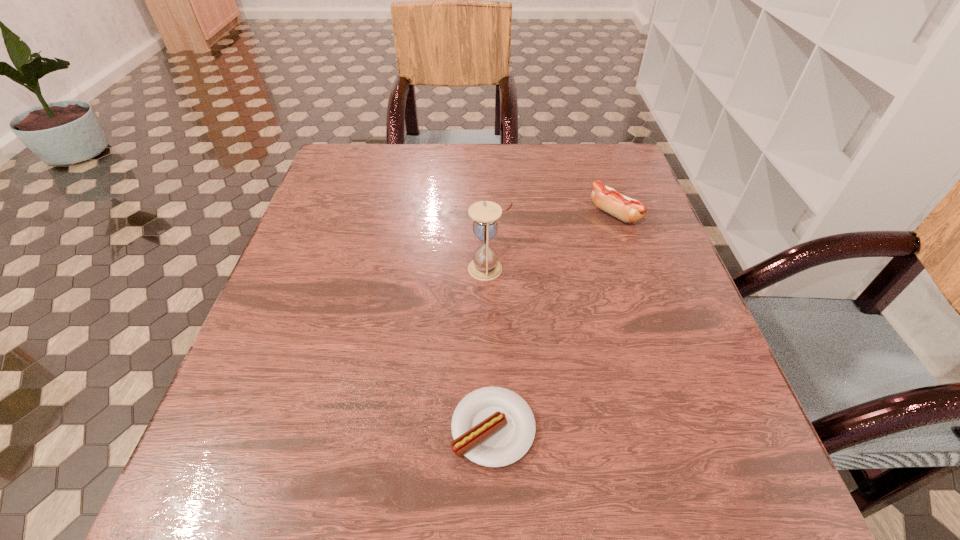
The image size is (960, 540). Identify the location of hourglass. coord(484,266).

Where is `the second farthest object`? the second farthest object is located at coordinates (484, 266).

At what (x,y) coordinates should I click in order to perform the action: click on the farther sausage. Please return your answer as a coordinate pair (x, y). This screenshot has width=960, height=540. Looking at the image, I should click on (628, 210).

At what (x,y) coordinates should I click in order to perform the action: click on the rightmost object. Please return your answer as a coordinate pair (x, y). The image size is (960, 540). Looking at the image, I should click on (628, 210).

Find the location of a particular element. Image resolution: width=960 pixels, height=540 pixels. the nearer sausage is located at coordinates (492, 426).

This screenshot has height=540, width=960. I want to click on the shorter sausage, so click(492, 426).

Image resolution: width=960 pixels, height=540 pixels. I want to click on free space located on the right of the second nearest object, so click(x=652, y=268).

Find the location of `free space located on the front of the farther sausage`. free space located on the front of the farther sausage is located at coordinates (668, 368).

I want to click on vacant space located 0.320m on the back of the shorter sausage, so click(490, 258).

Where is `object present at the near edge`? object present at the near edge is located at coordinates [x=492, y=426].